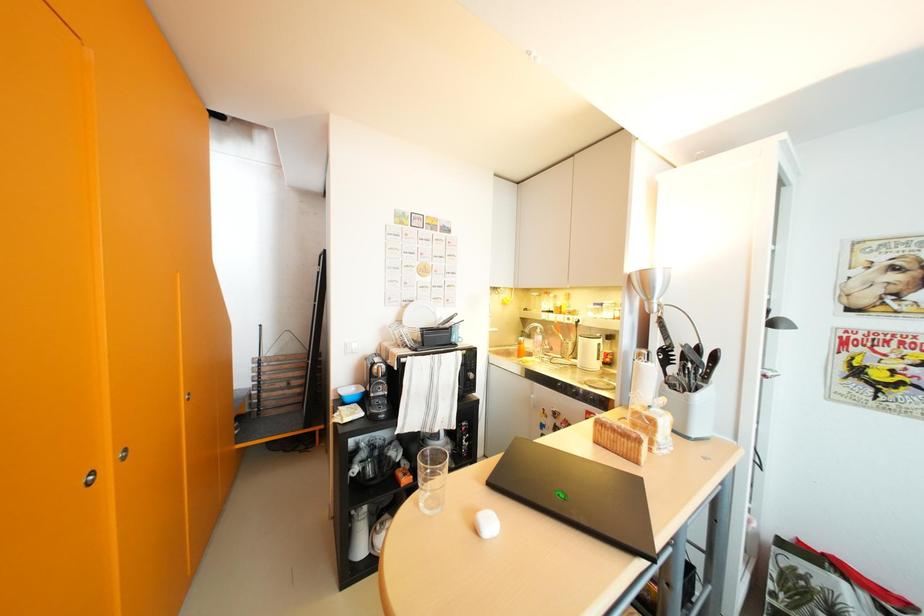
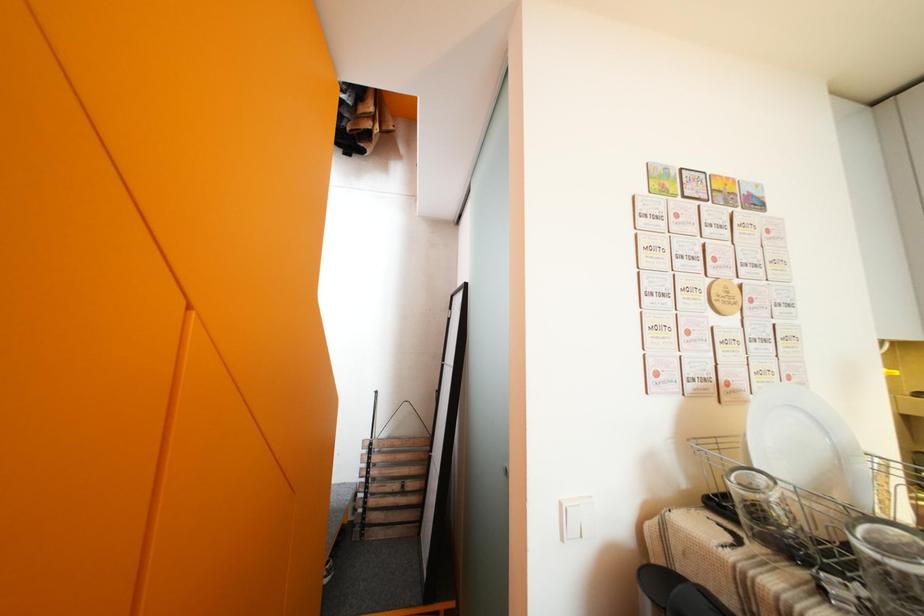
What movement of the cameraman would produce the second image?

The cameraman walked toward left, forward.